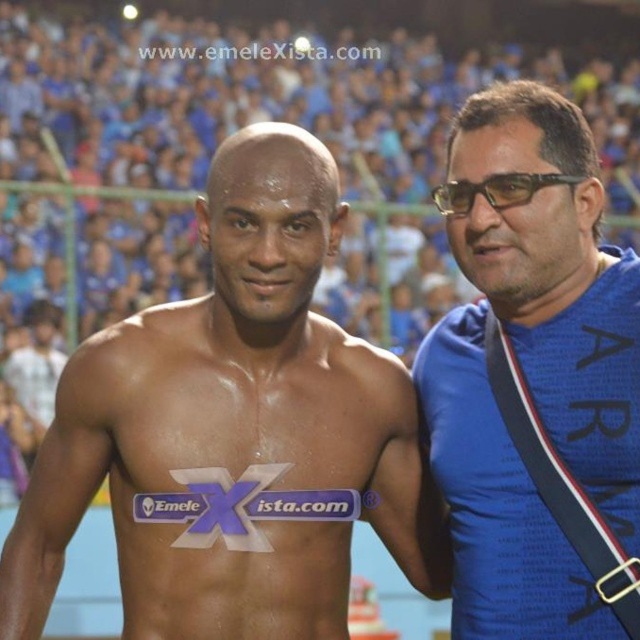
Question: Considering the real-world distances, which object is farthest from the black plastic glasses at right?

Choices:
 (A) shiny skin torso at center
 (B) blue fabric shirt at right

Answer: (A)

Question: Is shiny skin torso at center to the right of black plastic glasses at right from the viewer's perspective?

Choices:
 (A) yes
 (B) no

Answer: (B)

Question: Does blue fabric shirt at right appear on the right side of black plastic glasses at right?

Choices:
 (A) no
 (B) yes

Answer: (B)

Question: Among these points, which one is nearest to the camera?

Choices:
 (A) (561, 486)
 (B) (292, 588)

Answer: (B)

Question: Estimate the real-world distances between objects in this image. Which object is closer to the black plastic glasses at right?

Choices:
 (A) shiny skin torso at center
 (B) blue fabric shirt at right

Answer: (B)

Question: Considering the relative positions of shiny skin torso at center and blue fabric shirt at right in the image provided, where is shiny skin torso at center located with respect to blue fabric shirt at right?

Choices:
 (A) left
 (B) right

Answer: (A)